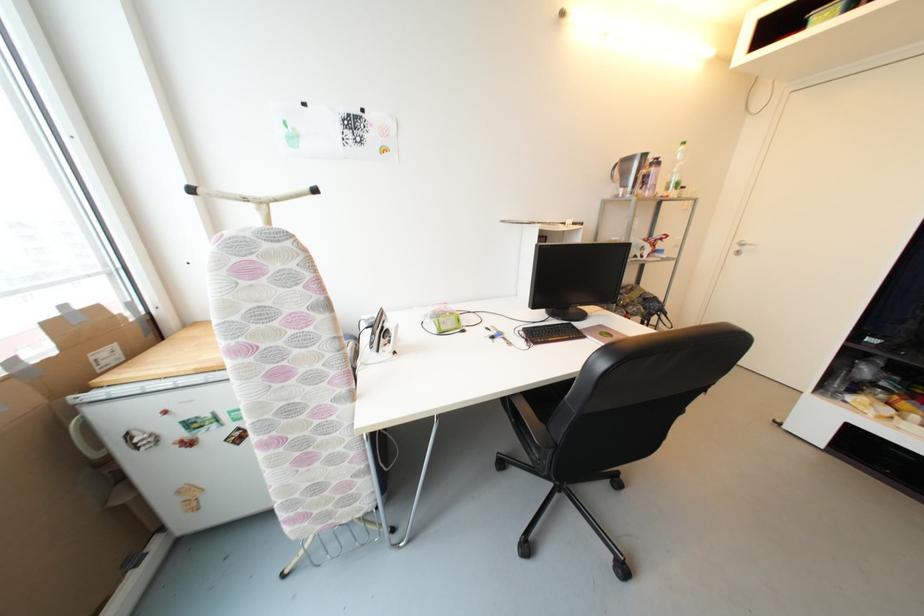
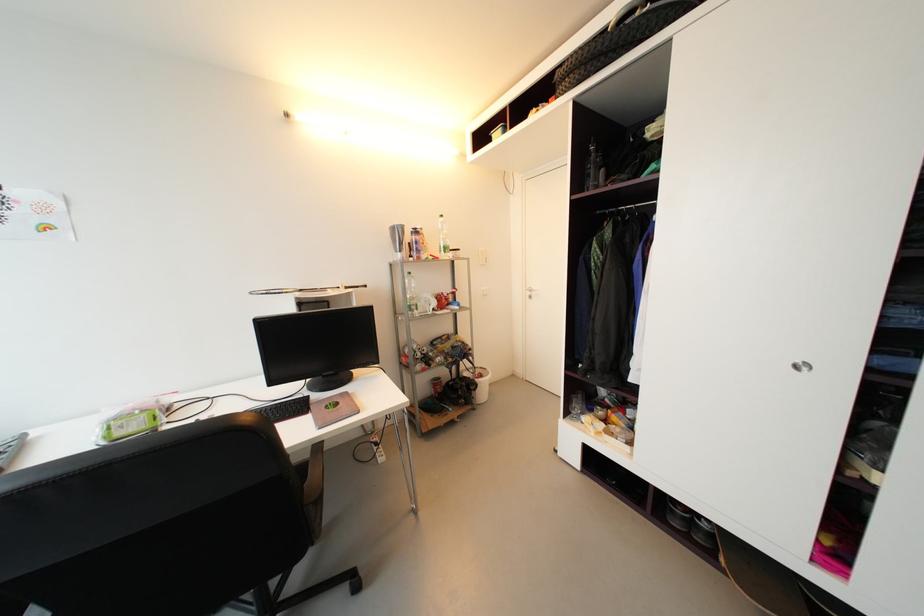
In the second image, find the point that corresponds to the point at 742,249 in the first image.

(533, 294)